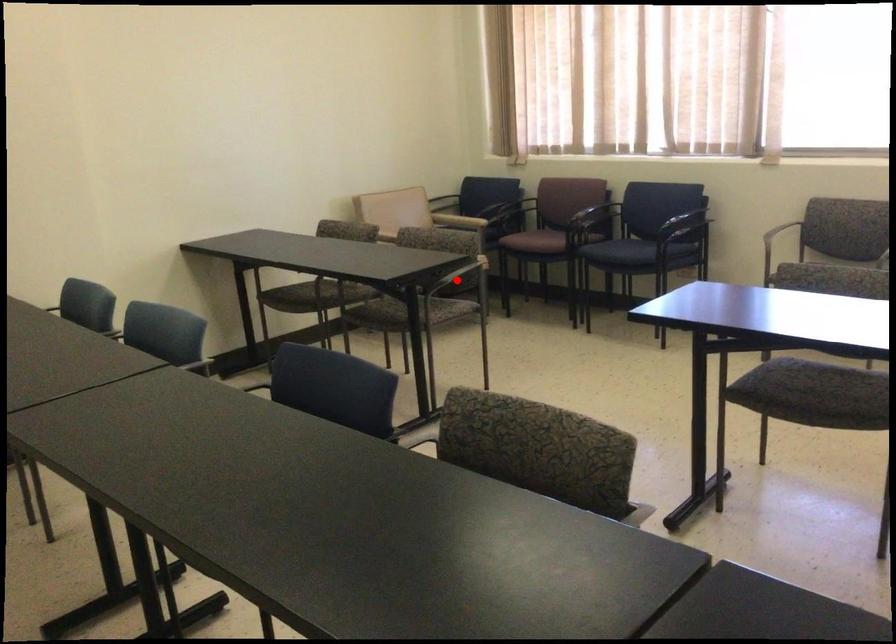
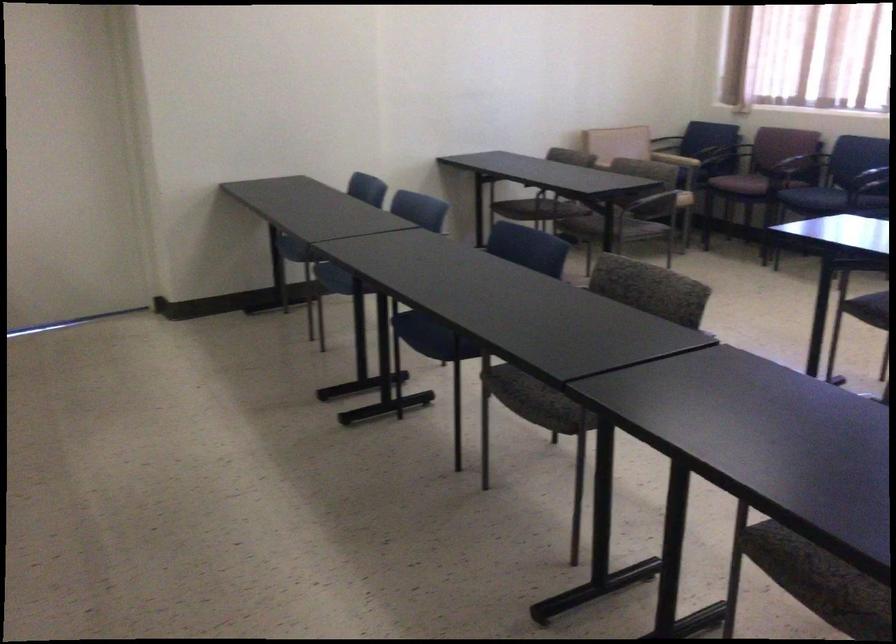
Question: I am providing you with two images of the same scene from different viewpoints. A red point is shown in image1. For the corresponding object point in image2, is it positioned nearer or farther from the camera?

Choices:
 (A) Nearer
 (B) Farther

Answer: (B)